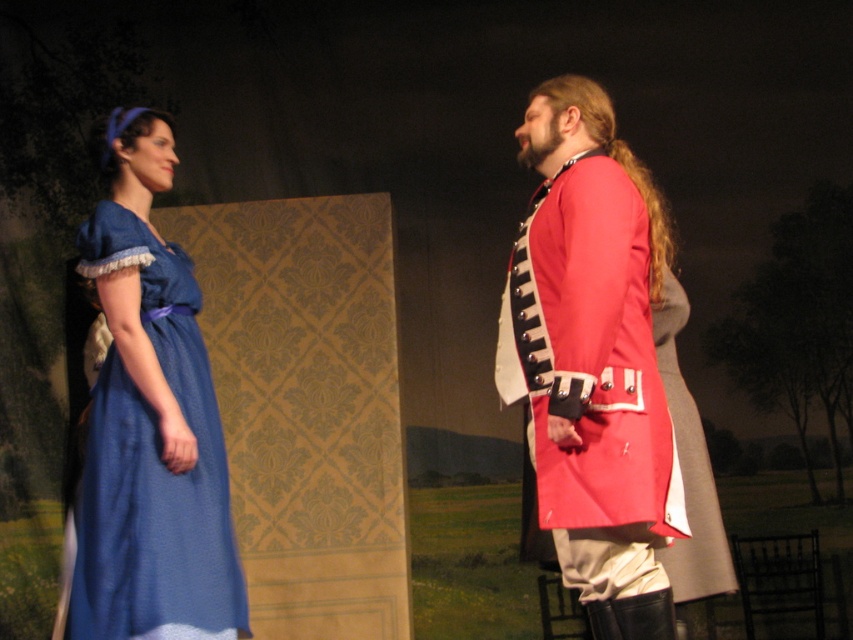
Which is more to the left, shiny red coat at center or matte blue dress at left?

Positioned to the left is matte blue dress at left.

Is shiny red coat at center shorter than matte blue dress at left?

Yes, shiny red coat at center is shorter than matte blue dress at left.

Measure the distance between point (540, 358) and camera.

Point (540, 358) and camera are 2.72 meters apart.

This screenshot has height=640, width=853. What are the coordinates of `shiny red coat at center` in the screenshot? It's located at (595, 358).